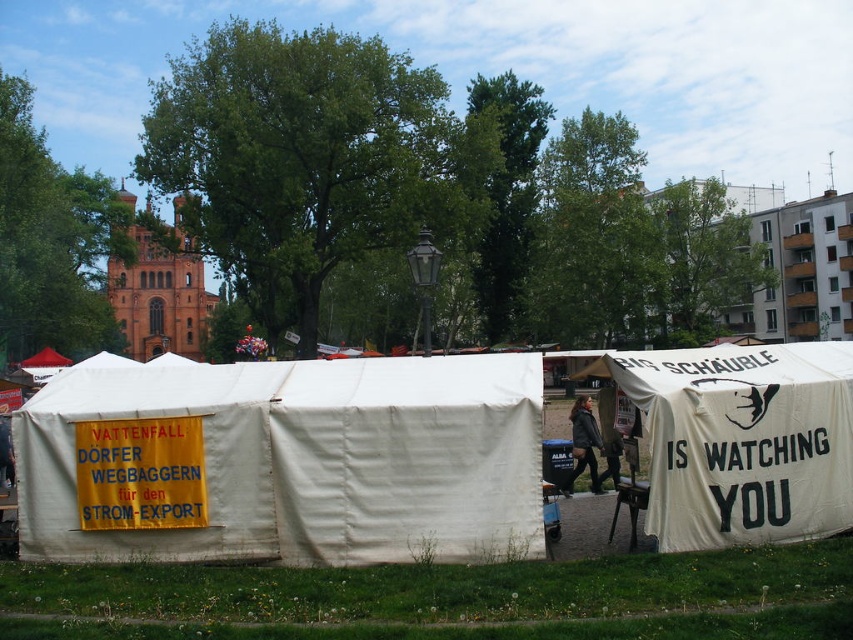
You are a photographer standing at the center of the park. You want to capture a photo that includes both the white canvas tent at right and the dark gray leather jacket at center. Since you have a wide angle lens, you need to know which object is wider to frame the shot properly. Which one is wider?

The white canvas tent at right is wider than the dark gray leather jacket at center.

You are organizing a small event and need to decide which tent to use for a presentation. The white canvas tent at center and the white canvas tent at right are available. Which tent has more space for attendees?

The white canvas tent at center has a larger width than the white canvas tent at right, so it provides more space for attendees.

You are standing at the point marked as point (283, 461) in the image. What object are you standing on?

You are standing on the white canvas tent at center.